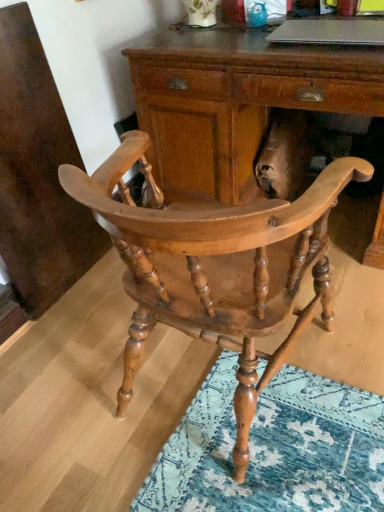
What are the coordinates of `vacant space that is to the left of silver metallic laptop at upper center` in the screenshot? It's located at (244, 44).